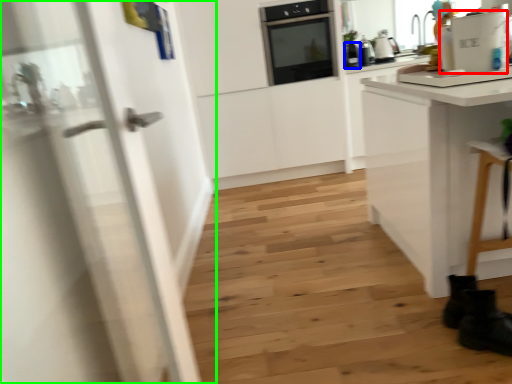
Question: Considering the real-world distances, which object is farthest from appliance (highlighted by a red box)? kitchen appliance (highlighted by a blue box) or door (highlighted by a green box)?

Choices:
 (A) kitchen appliance
 (B) door

Answer: (A)